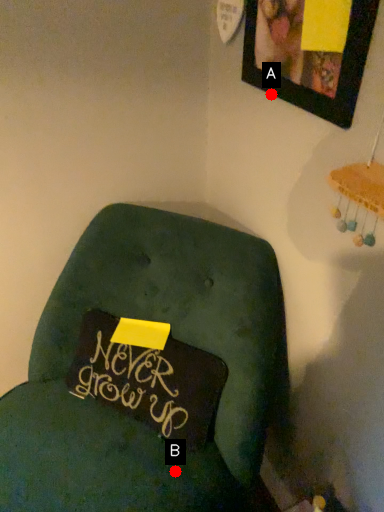
Question: Two points are circled on the image, labeled by A and B beside each circle. Among these points, which one is nearest to the camera?

Choices:
 (A) A is closer
 (B) B is closer

Answer: (A)